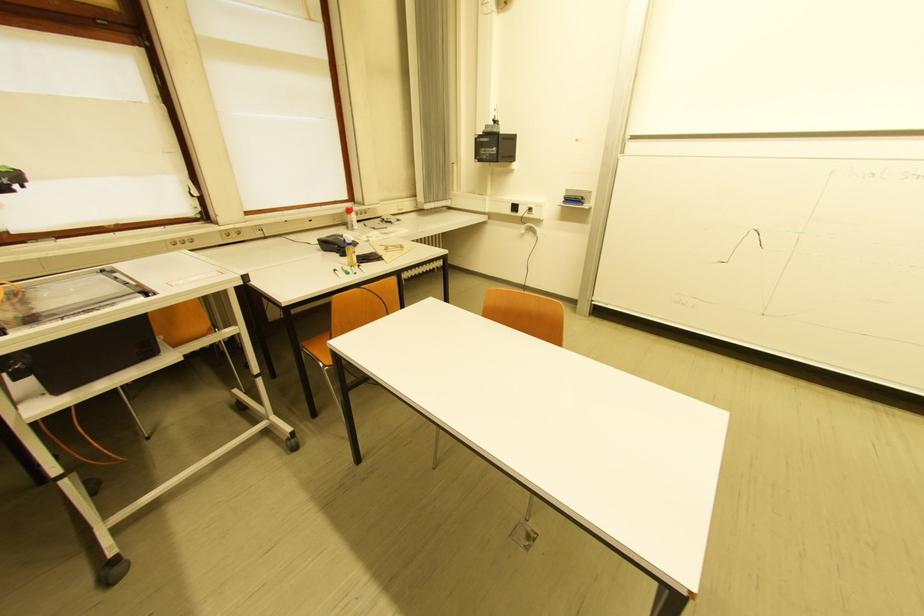
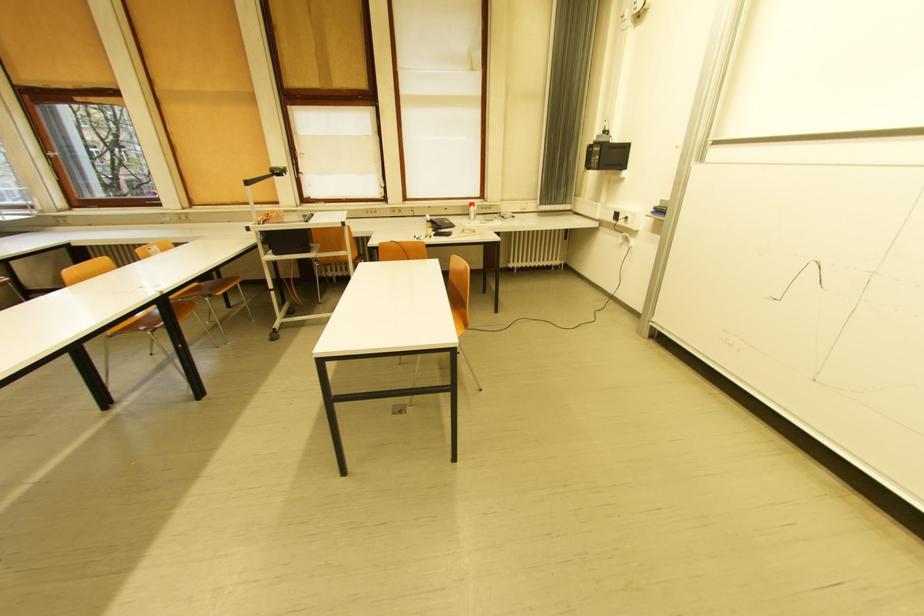
Question: I am providing you with two images of the same scene from different viewpoints. After the viewpoint changes to image2, which objects are now occluded?

Choices:
 (A) chair sitting surface
 (B) blue whiteboard eraser
 (C) telephone handset
 (D) none of these

Answer: (D)